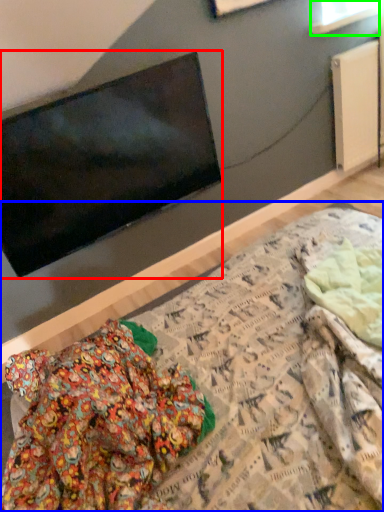
Question: Considering the real-world distances, which object is closest to television (highlighted by a red box)? bed (highlighted by a blue box) or window (highlighted by a green box).

Choices:
 (A) bed
 (B) window

Answer: (A)